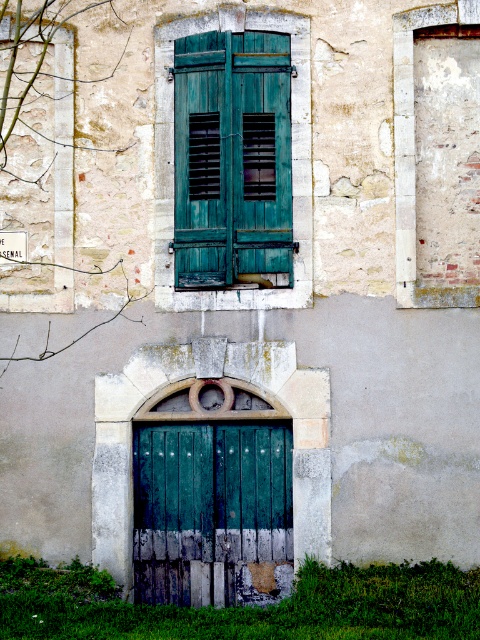
You are standing in front of the aged stone building and notice the teal wood shutters at center. Where exactly are they located on the building?

The teal wood shutters at center are located at point (231, 160) on the building.

You are a painter who needs to paint both the teal wood shutters at center and the green wooden door at center. You have a ladder that can reach up to 6 feet. Can you paint both objects without moving the ladder?

The distance between the teal wood shutters at center and the green wooden door at center is 6.50 feet. Since the ladder can only reach up to 6 feet, you cannot paint both objects without moving the ladder because the distance exceeds the ladder height.

You are a painter hired to paint the teal wood shutters at center and the green wooden door at center. You need to decide which one to paint first. Based on their positions, which object is higher and should be painted first?

The teal wood shutters at center is above the green wooden door at center, so it should be painted first.